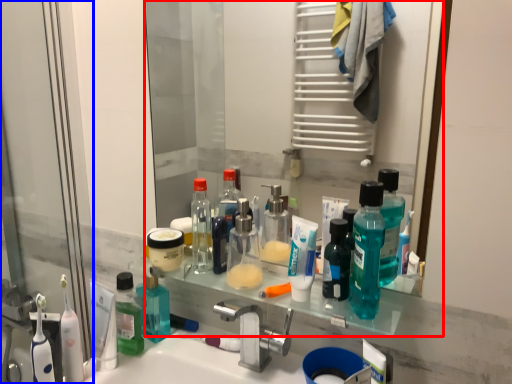
Question: Which of the following is the closest to the observer, mirror (highlighted by a red box) or screen door (highlighted by a blue box)?

Choices:
 (A) mirror
 (B) screen door

Answer: (A)